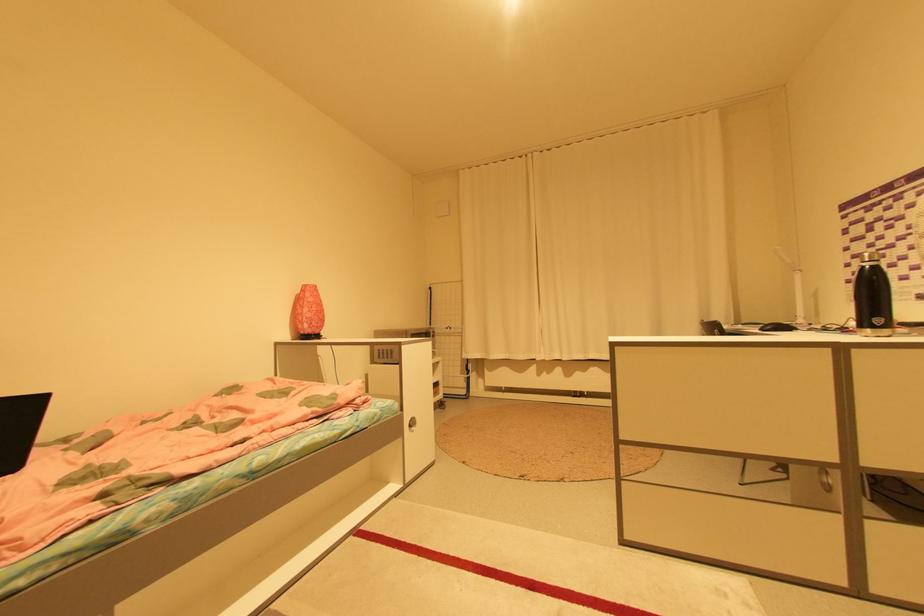
Locate an element on the screen. Image resolution: width=924 pixels, height=616 pixels. white desk lamp is located at coordinates (794, 284).